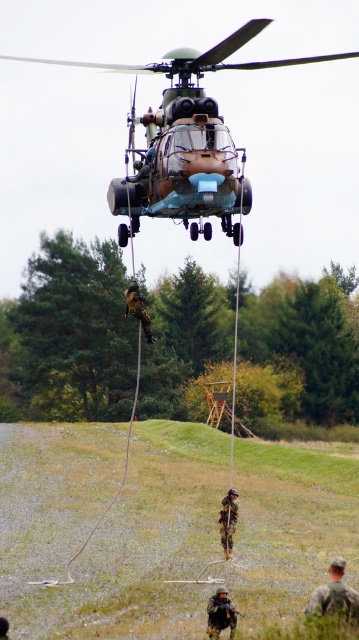
You are a soldier in the field and need to retrieve an item from the camouflage fabric uniform at center. The camouflage fabric soldier at center is your teammate. Which direction should you move relative to your teammate to reach the uniform?

The camouflage fabric uniform at center is to the right of the camouflage fabric soldier at center. Therefore, you should move to the right relative to your teammate to reach the uniform.